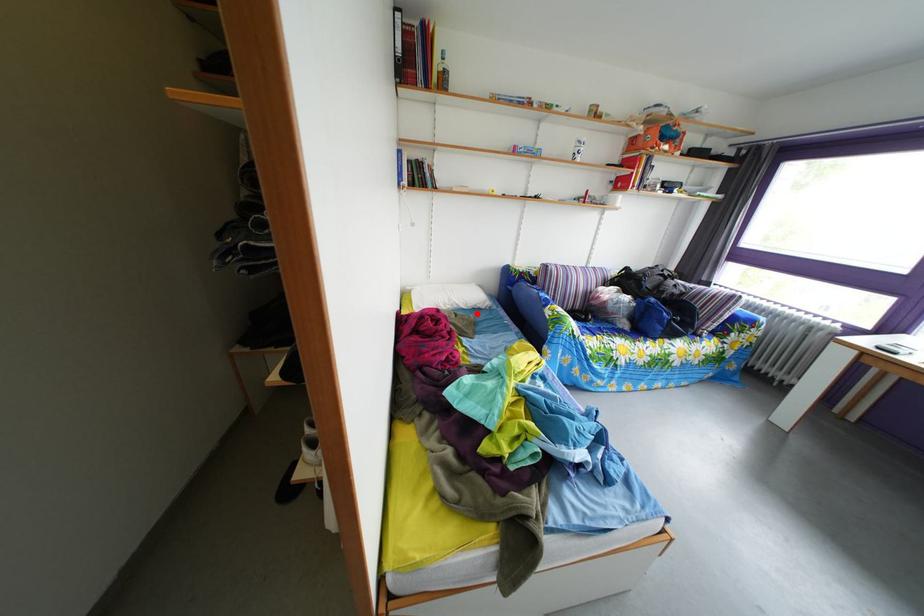
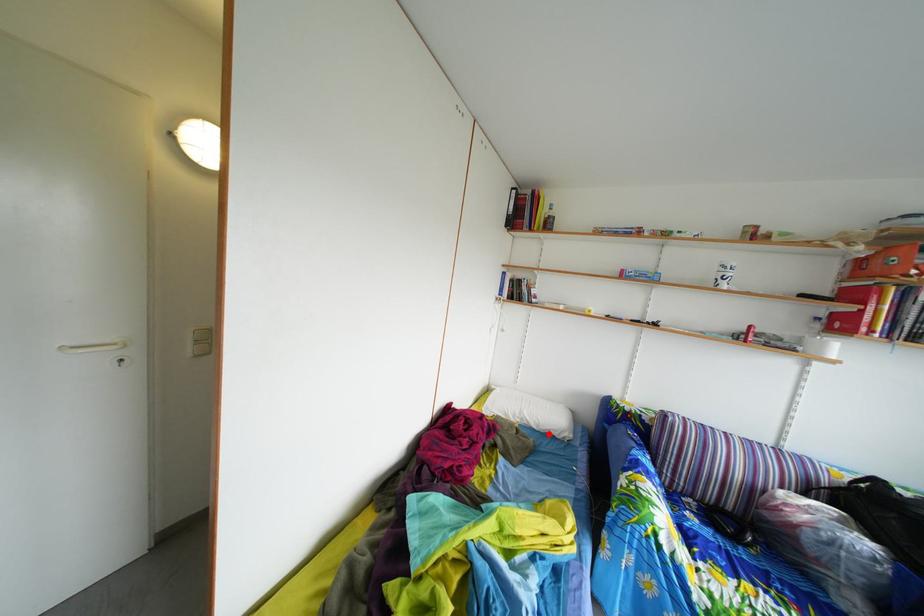
I am providing you with two images of the same scene from different viewpoints. A red point is marked on the first image and another point is marked on the second image. Do the highlighted points in image1 and image2 indicate the same real-world spot?

Yes